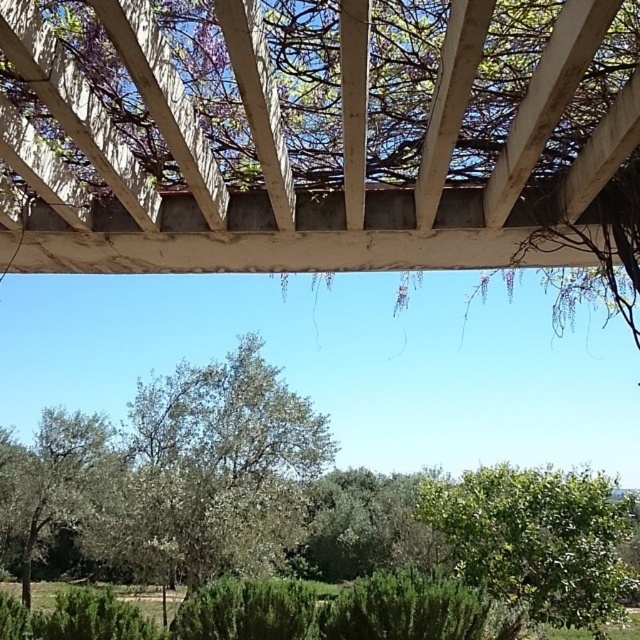
Question: Can you confirm if green leafy tree at center is positioned below green leafy tree at lower right?

Choices:
 (A) yes
 (B) no

Answer: (B)

Question: Can you confirm if green leafy tree at center is positioned above green leafy tree at lower right?

Choices:
 (A) yes
 (B) no

Answer: (A)

Question: Does green leafy tree at center have a smaller size compared to green leafy tree at lower right?

Choices:
 (A) no
 (B) yes

Answer: (B)

Question: Which object appears closest to the camera in this image?

Choices:
 (A) green leafy tree at lower right
 (B) green leafy tree at center

Answer: (B)

Question: Which point is farther to the camera?

Choices:
 (A) green leafy tree at lower right
 (B) green leafy tree at center

Answer: (A)